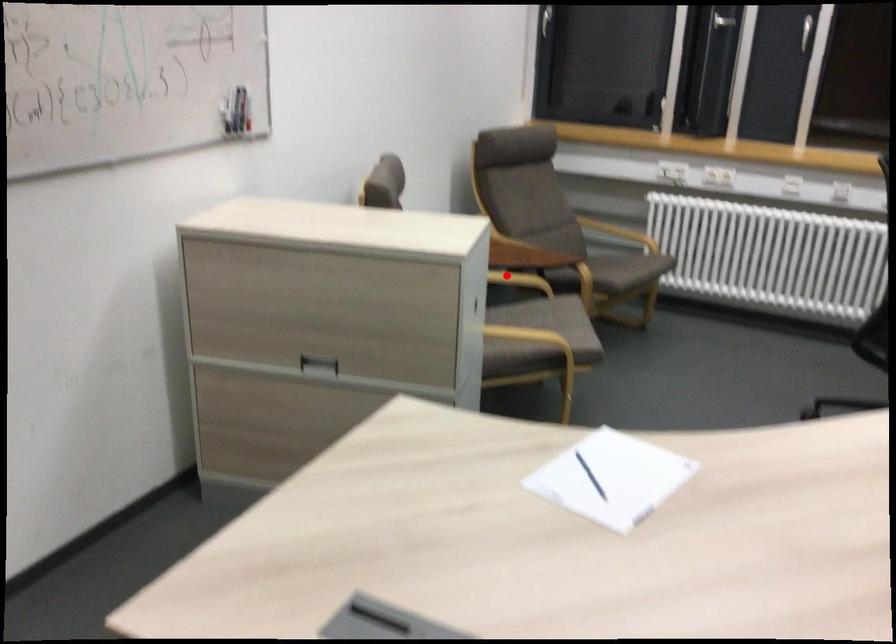
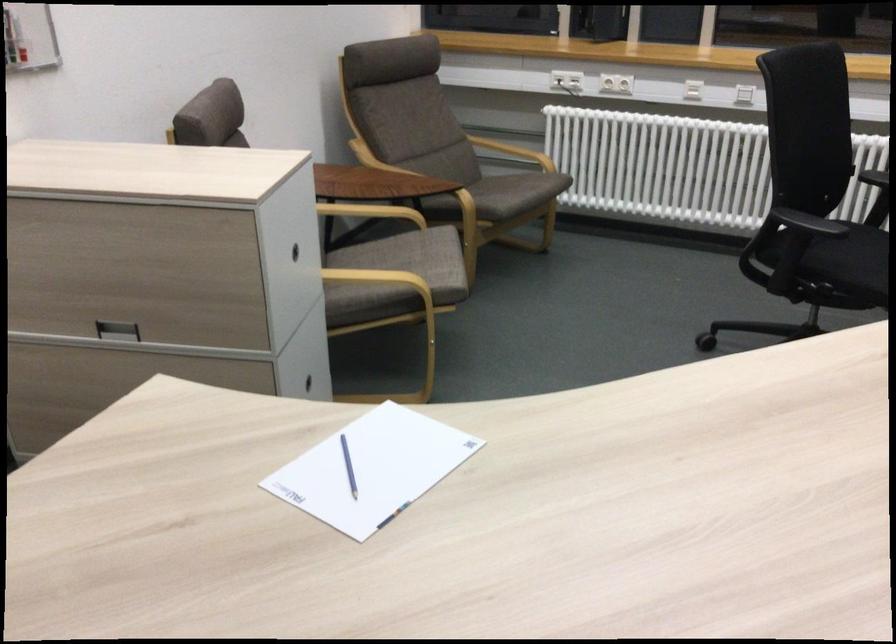
Find the pixel in the second image that matches the highlighted location in the first image.

(371, 212)